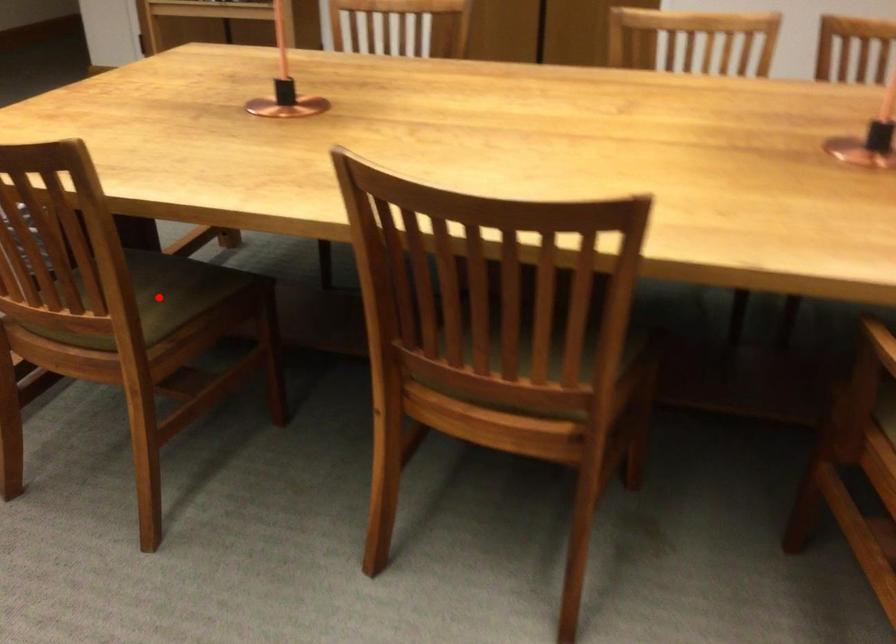
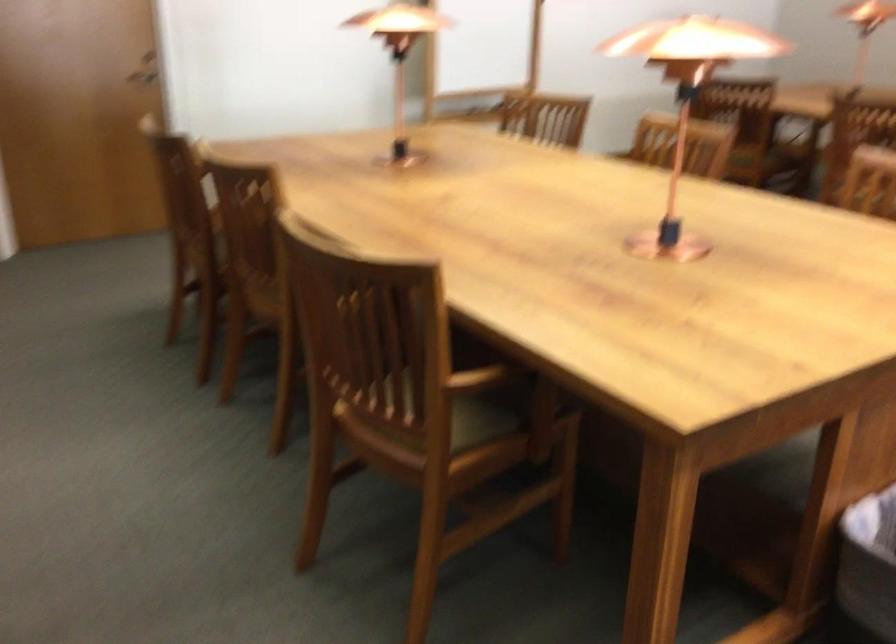
Question: I am providing you with two images of the same scene from different viewpoints. A red point is marked on the first image. Can you still see the location of the red point in image 2?

Choices:
 (A) Yes
 (B) No

Answer: (B)